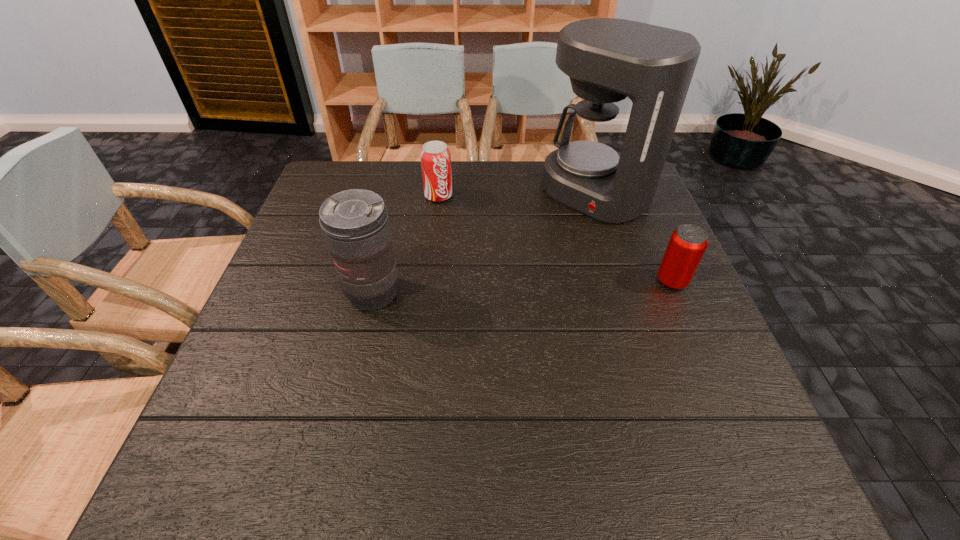
Locate an element on the screen. Image resolution: width=960 pixels, height=540 pixels. telephoto lens is located at coordinates (355, 224).

You are a GUI agent. You are given a task and a screenshot of the screen. Output one action in this format:
    pyautogui.click(x=<x>, y=<y>)
    Task: Click on the second tallest object
    
    Given the screenshot: What is the action you would take?
    pyautogui.click(x=355, y=224)

Where is `can`? Image resolution: width=960 pixels, height=540 pixels. can is located at coordinates (687, 245).

The width and height of the screenshot is (960, 540). Identify the location of soda can. (x=435, y=156).

Find the location of a particular element. coffee maker is located at coordinates (607, 59).

Image resolution: width=960 pixels, height=540 pixels. In order to click on blank space located 0.070m on the side of the leftmost object where the control switches are located in this screenshot , I will do `click(362, 342)`.

Image resolution: width=960 pixels, height=540 pixels. Find the location of `free space located 0.090m on the front of the can`. free space located 0.090m on the front of the can is located at coordinates (x=690, y=324).

Where is `vacant space located on the logo side of the second object from left to right`? vacant space located on the logo side of the second object from left to right is located at coordinates (459, 226).

What are the coordinates of `free space located on the logo side of the second object from left to right` in the screenshot? It's located at (496, 282).

I want to click on blank area located 0.120m on the logo side of the second object from left to right, so click(460, 228).